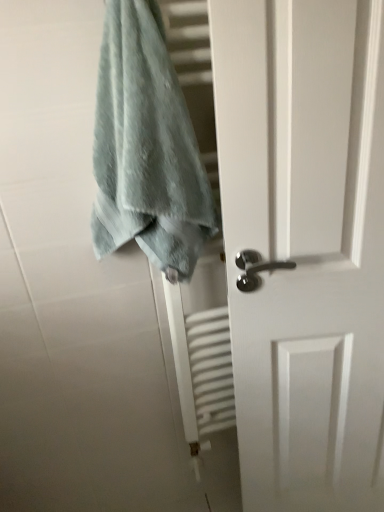
What do you see at coordinates (304, 244) in the screenshot?
I see `white matte door at center` at bounding box center [304, 244].

Where is `white matte door at center`? The width and height of the screenshot is (384, 512). white matte door at center is located at coordinates (304, 244).

What do you see at coordinates (146, 148) in the screenshot?
I see `soft blue towel at upper left` at bounding box center [146, 148].

Locate an element on the screen. soft blue towel at upper left is located at coordinates (146, 148).

At what (x,y) coordinates should I click in order to perform the action: click on white matte door at center. Please return your answer as a coordinate pair (x, y). The height and width of the screenshot is (512, 384). Looking at the image, I should click on (304, 244).

Considering the positions of objects white matte door at center and soft blue towel at upper left in the image provided, who is more to the left, white matte door at center or soft blue towel at upper left?

soft blue towel at upper left is more to the left.

Is white matte door at center in front of or behind soft blue towel at upper left in the image?

Clearly, white matte door at center is behind soft blue towel at upper left.

Is point (328, 236) less distant than point (192, 181)?

No, it is not.

From the image's perspective, which one is positioned lower, white matte door at center or soft blue towel at upper left?

white matte door at center is shown below in the image.

From a real-world perspective, is white matte door at center beneath soft blue towel at upper left?

Yes, from a real-world perspective, white matte door at center is under soft blue towel at upper left.

Is white matte door at center wider than soft blue towel at upper left?

In fact, white matte door at center might be narrower than soft blue towel at upper left.

Does white matte door at center have a greater height compared to soft blue towel at upper left?

Correct, white matte door at center is much taller as soft blue towel at upper left.

Considering the relative sizes of white matte door at center and soft blue towel at upper left in the image provided, is white matte door at center bigger than soft blue towel at upper left?

Yes.

Is white matte door at center outside of soft blue towel at upper left?

white matte door at center is positioned outside soft blue towel at upper left.

Is white matte door at center directly adjacent to soft blue towel at upper left?

white matte door at center and soft blue towel at upper left are clearly separated.

Is soft blue towel at upper left at the back of white matte door at center?

No, white matte door at center's orientation is not away from soft blue towel at upper left.

How different are the orientations of white matte door at center and soft blue towel at upper left in degrees?

The facing directions of white matte door at center and soft blue towel at upper left are 10 degrees apart.

The height and width of the screenshot is (512, 384). Identify the location of towel above the white matte door at center (from a real-world perspective). (146, 148).

Considering the relative positions of soft blue towel at upper left and white matte door at center in the image provided, is soft blue towel at upper left to the left of white matte door at center from the viewer's perspective?

Yes.

Which object is closer to the camera taking this photo, soft blue towel at upper left or white matte door at center?

soft blue towel at upper left is in front.

Is point (154, 81) positioned behind point (268, 241)?

No, it is in front of (268, 241).

From the image's perspective, who appears lower, soft blue towel at upper left or white matte door at center?

From the image's view, white matte door at center is below.

From a real-world perspective, does soft blue towel at upper left sit lower than white matte door at center?

No, from a real-world perspective, soft blue towel at upper left is not under white matte door at center.

Considering the sizes of soft blue towel at upper left and white matte door at center in the image, is soft blue towel at upper left wider or thinner than white matte door at center?

In the image, soft blue towel at upper left appears to be wider than white matte door at center.

From their relative heights in the image, would you say soft blue towel at upper left is taller or shorter than white matte door at center?

In the image, soft blue towel at upper left appears to be shorter than white matte door at center.

Considering the sizes of soft blue towel at upper left and white matte door at center in the image, is soft blue towel at upper left bigger or smaller than white matte door at center?

soft blue towel at upper left is smaller than white matte door at center.

Would you say soft blue towel at upper left contains white matte door at center?

Definitely not — white matte door at center is not inside soft blue towel at upper left.

In the scene shown: Is soft blue towel at upper left with white matte door at center?

No.

Is soft blue towel at upper left oriented towards white matte door at center?

No, soft blue towel at upper left is not turned towards white matte door at center.

How different are the orientations of soft blue towel at upper left and white matte door at center in degrees?

The facing directions of soft blue towel at upper left and white matte door at center are 10 degrees apart.

The height and width of the screenshot is (512, 384). In order to click on towel above the white matte door at center (from the image's perspective) in this screenshot , I will do (146, 148).

The width and height of the screenshot is (384, 512). I want to click on door on the right of soft blue towel at upper left, so click(x=304, y=244).

Find the location of a particular element. The image size is (384, 512). door below the soft blue towel at upper left (from the image's perspective) is located at coordinates (304, 244).